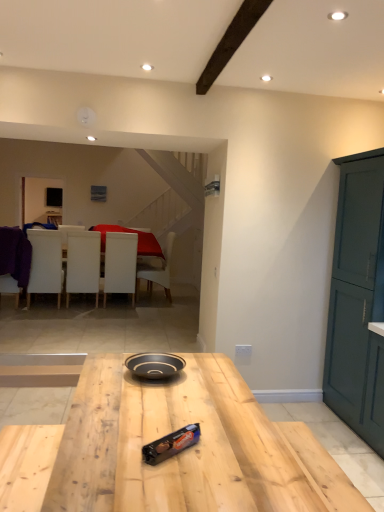
Measure the distance between point (104, 278) and camera.

The depth of point (104, 278) is 6.39 meters.

This screenshot has width=384, height=512. Identify the location of matte black bowl at center. (155, 365).

Measure the distance between point (185, 428) and camera.

Point (185, 428) and camera are 1.66 meters apart from each other.

The image size is (384, 512). Describe the element at coordinates (171, 444) in the screenshot. I see `shiny chocolate bar at center` at that location.

The image size is (384, 512). What do you see at coordinates (358, 300) in the screenshot?
I see `teal matte cabinet at right` at bounding box center [358, 300].

This screenshot has height=512, width=384. In order to click on white matte chair at center, the fourth chair positioned from the left in this screenshot , I will do `click(120, 264)`.

Does matte black bowl at center turn towards teal matte cabinet at right?

No, matte black bowl at center does not turn towards teal matte cabinet at right.

Considering the sizes of objects matte black bowl at center and teal matte cabinet at right in the image provided, who is wider, matte black bowl at center or teal matte cabinet at right?

teal matte cabinet at right.

Can you confirm if matte black bowl at center is smaller than teal matte cabinet at right?

Yes.

Is matte black bowl at center at the right side of teal matte cabinet at right?

In fact, matte black bowl at center is to the left of teal matte cabinet at right.

Identify the location of food behind the natural wood table at center. This screenshot has width=384, height=512. (171, 444).

Considering the relative sizes of natural wood table at center and shiny chocolate bar at center in the image provided, is natural wood table at center shorter than shiny chocolate bar at center?

No, natural wood table at center is not shorter than shiny chocolate bar at center.

Does natural wood table at center appear on the right side of shiny chocolate bar at center?

No, natural wood table at center is not to the right of shiny chocolate bar at center.

How many degrees apart are the facing directions of natural wood table at center and shiny chocolate bar at center?

The angular difference between natural wood table at center and shiny chocolate bar at center is 52.4 degrees.

Between teal matte cabinet at right and matte black bowl at center, which one has larger width?

teal matte cabinet at right is wider.

Is teal matte cabinet at right taller than matte black bowl at center?

Indeed, teal matte cabinet at right has a greater height compared to matte black bowl at center.

Consider the image. Could you tell me if teal matte cabinet at right is turned towards matte black bowl at center?

No, teal matte cabinet at right is not facing towards matte black bowl at center.

From a real-world perspective, is white matte chair at center, the 2th chair from the right, located beneath white matte chair at center, the 3th chair viewed from the right?

Yes, from a real-world perspective, white matte chair at center, the 2th chair from the right, is below white matte chair at center, the 3th chair viewed from the right.

Considering the positions of objects white matte chair at center, the fourth chair positioned from the left, and white matte chair at center, the 3th chair viewed from the right, in the image provided, who is behind, white matte chair at center, the fourth chair positioned from the left, or white matte chair at center, the 3th chair viewed from the right,?

Positioned behind is white matte chair at center, the fourth chair positioned from the left.

From the picture: Is white matte chair at center, the 2th chair from the right, oriented away from white matte chair at center, the 3th chair viewed from the right?

No, white matte chair at center, the 2th chair from the right, is not facing away from white matte chair at center, the 3th chair viewed from the right.

Is white matte chair at left, the 2th chair in the left-to-right sequence, surrounding teal matte cabinet at right?

No, teal matte cabinet at right is not inside white matte chair at left, the 2th chair in the left-to-right sequence.

Is white matte chair at left, acting as the 4th chair starting from the right, wider or thinner than teal matte cabinet at right?

In the image, white matte chair at left, acting as the 4th chair starting from the right, appears to be more narrow than teal matte cabinet at right.

From the image's perspective, is white matte chair at left, acting as the 4th chair starting from the right, under teal matte cabinet at right?

No, from the image's perspective, white matte chair at left, acting as the 4th chair starting from the right, is not below teal matte cabinet at right.

From the teal matte cabinet at right, count the 4th chair to the left and point to it. Please provide its 2D coordinates.

[(45, 263)]

From a real-world perspective, is purple fabric chair at left, the 5th chair in the right-to-left sequence, on top of white matte chair at left, acting as the 4th chair starting from the right?

No, from a real-world perspective, purple fabric chair at left, the 5th chair in the right-to-left sequence, is not above white matte chair at left, acting as the 4th chair starting from the right.

Would you say purple fabric chair at left, the 5th chair in the right-to-left sequence, is inside or outside white matte chair at left, acting as the 4th chair starting from the right?

purple fabric chair at left, the 5th chair in the right-to-left sequence, is not enclosed by white matte chair at left, acting as the 4th chair starting from the right.

Image resolution: width=384 pixels, height=512 pixels. I want to click on chair on the left of white matte chair at left, acting as the 4th chair starting from the right, so click(9, 260).

What's the angular difference between purple fabric chair at left, the 5th chair in the right-to-left sequence, and white matte chair at left, acting as the 4th chair starting from the right,'s facing directions?

The facing directions of purple fabric chair at left, the 5th chair in the right-to-left sequence, and white matte chair at left, acting as the 4th chair starting from the right, are 0.00192 degrees apart.

Looking at their sizes, would you say matte black bowl at center is wider or thinner than purple fabric chair at left, the 1th chair in the left-to-right sequence?

Clearly, matte black bowl at center has less width compared to purple fabric chair at left, the 1th chair in the left-to-right sequence.

Does matte black bowl at center appear on the left side of purple fabric chair at left, the 1th chair in the left-to-right sequence?

Incorrect, matte black bowl at center is not on the left side of purple fabric chair at left, the 1th chair in the left-to-right sequence.

Considering the positions of objects matte black bowl at center and purple fabric chair at left, the 5th chair in the right-to-left sequence, in the image provided, who is behind, matte black bowl at center or purple fabric chair at left, the 5th chair in the right-to-left sequence,?

purple fabric chair at left, the 5th chair in the right-to-left sequence, is further from the camera.

Can you confirm if matte black bowl at center is taller than purple fabric chair at left, the 5th chair in the right-to-left sequence?

In fact, matte black bowl at center may be shorter than purple fabric chair at left, the 5th chair in the right-to-left sequence.

The image size is (384, 512). In the image, there is a matte black bowl at center. Find the location of `cabinetry above it (from the image's perspective)`. cabinetry above it (from the image's perspective) is located at coordinates (358, 300).

Where is `food behind the natural wood table at center`? The width and height of the screenshot is (384, 512). food behind the natural wood table at center is located at coordinates (171, 444).

Estimate the real-world distances between objects in this image. Which object is further from matte black bowl at center, teal matte cabinet at right or white matte chair at center, arranged as the third chair when viewed from the left?

white matte chair at center, arranged as the third chair when viewed from the left.

Estimate the real-world distances between objects in this image. Which object is closer to white leather chair at center, the first chair positioned from the right, natural wood table at center or white matte chair at center, the 3th chair viewed from the right?

Among the two, white matte chair at center, the 3th chair viewed from the right, is located nearer to white leather chair at center, the first chair positioned from the right.

Estimate the real-world distances between objects in this image. Which object is further from matte black bowl at center, teal matte cabinet at right or purple fabric chair at left, the 1th chair in the left-to-right sequence?

purple fabric chair at left, the 1th chair in the left-to-right sequence, lies further to matte black bowl at center than the other object.

Consider the image. Looking at the image, which one is located further to white matte chair at left, acting as the 4th chair starting from the right, white matte chair at center, the 2th chair from the right, or purple fabric chair at left, the 1th chair in the left-to-right sequence?

The object further to white matte chair at left, acting as the 4th chair starting from the right, is white matte chair at center, the 2th chair from the right.

Based on their spatial positions, is shiny chocolate bar at center or white matte chair at center, arranged as the third chair when viewed from the left, further from white matte chair at left, the 2th chair in the left-to-right sequence?

The object further to white matte chair at left, the 2th chair in the left-to-right sequence, is shiny chocolate bar at center.

Estimate the real-world distances between objects in this image. Which object is closer to purple fabric chair at left, the 1th chair in the left-to-right sequence, white leather chair at center, which appears as the fifth chair when viewed from the left, or natural wood table at center?

Based on the image, white leather chair at center, which appears as the fifth chair when viewed from the left, appears to be nearer to purple fabric chair at left, the 1th chair in the left-to-right sequence.

From the image, which object appears to be farther from matte black bowl at center, white matte chair at center, arranged as the third chair when viewed from the left, or purple fabric chair at left, the 1th chair in the left-to-right sequence?

white matte chair at center, arranged as the third chair when viewed from the left, lies further to matte black bowl at center than the other object.

Which object lies further to the anchor point matte black bowl at center, natural wood table at center or shiny chocolate bar at center?

Among the two, shiny chocolate bar at center is located further to matte black bowl at center.

Locate an element on the screen. The height and width of the screenshot is (512, 384). chair between white matte chair at center, the 3th chair viewed from the right, and white leather chair at center, the first chair positioned from the right, from left to right is located at coordinates (120, 264).

Locate an element on the screen. This screenshot has width=384, height=512. cabinetry positioned between shiny chocolate bar at center and purple fabric chair at left, the 5th chair in the right-to-left sequence, from near to far is located at coordinates [x=358, y=300].

Identify the location of cabinetry positioned between shiny chocolate bar at center and white matte chair at center, the fourth chair positioned from the left, from near to far. (358, 300).

In order to click on bowl positioned between shiny chocolate bar at center and purple fabric chair at left, the 5th chair in the right-to-left sequence, from near to far in this screenshot , I will do `click(155, 365)`.